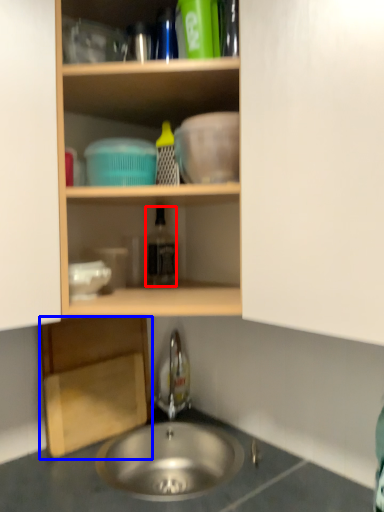
Question: Which object appears closest to the camera in this image, bottle (highlighted by a red box) or cabinetry (highlighted by a blue box)?

Choices:
 (A) bottle
 (B) cabinetry

Answer: (B)